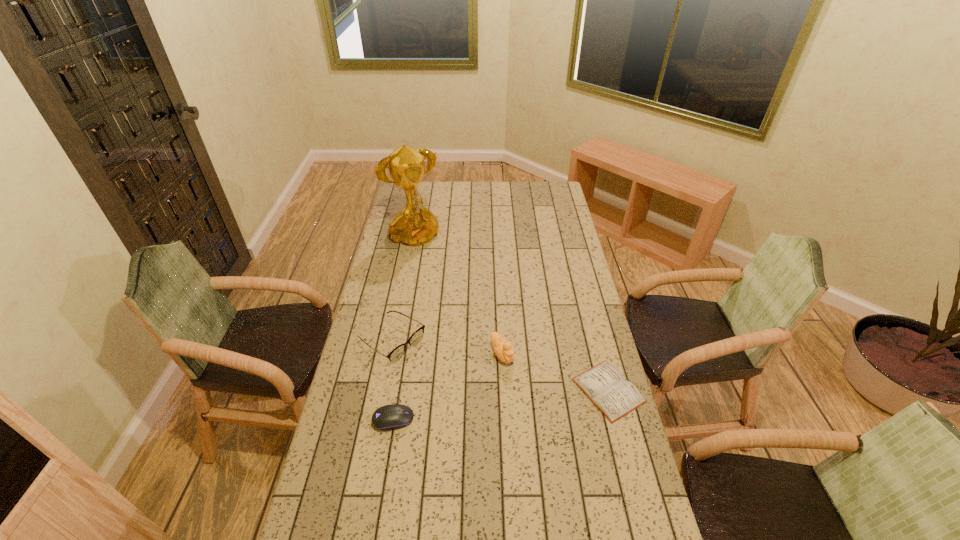
At what (x,y) coordinates should I click in order to perform the action: click on free space between the third tallest object and the second tallest object. Please return your answer as a coordinate pair (x, y). Looking at the image, I should click on (446, 347).

Locate an element on the screen. This screenshot has height=540, width=960. free space between the farthest object and the fourth tallest object is located at coordinates (403, 329).

Image resolution: width=960 pixels, height=540 pixels. I want to click on vacant space in between the spectacles and the fourth tallest object, so click(x=393, y=380).

I want to click on empty space between the computer mouse and the second object from right to left, so click(x=447, y=387).

Identify the location of free space that is in between the diary and the third tallest object. (500, 366).

Locate an element on the screen. vacant point located between the fourth tallest object and the duckling is located at coordinates (447, 387).

Where is `empty space that is in between the spectacles and the diary`? The height and width of the screenshot is (540, 960). empty space that is in between the spectacles and the diary is located at coordinates (500, 366).

Where is `object that is the closest one to the fourth object from left to right`? The width and height of the screenshot is (960, 540). object that is the closest one to the fourth object from left to right is located at coordinates [x=605, y=386].

Choose which object is the second nearest neighbor to the fourth shortest object. Please provide its 2D coordinates. Your answer should be formatted as a tuple, i.e. [(x, y)], where the tuple contains the x and y coordinates of a point satisfying the conditions above.

[(416, 337)]

I want to click on vacant point that satisfies the following two spatial constraints: 1. on the front side of the fourth object from left to right; 2. on the right side of the rightmost object, so click(504, 390).